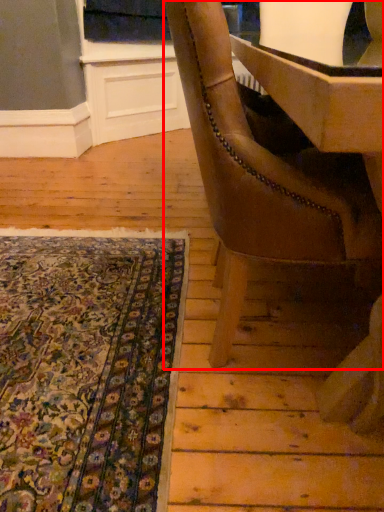
Question: From the image's perspective, what is the correct spatial positioning of chair (annotated by the red box) in reference to mat?

Choices:
 (A) below
 (B) above

Answer: (B)